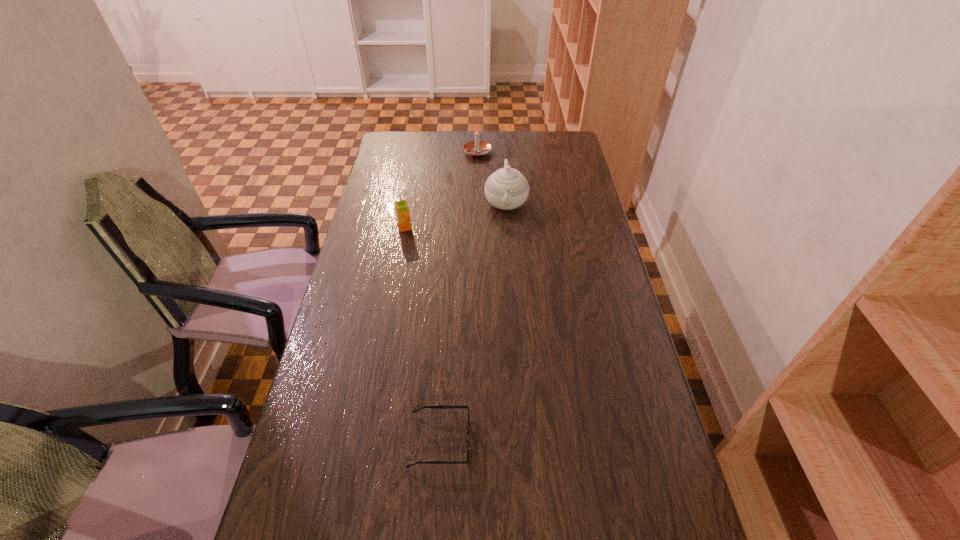
Identify the location of free space between the third farthest object and the second farthest object. (455, 215).

Where is `vacant area that lies between the candle and the nearest object`? The image size is (960, 540). vacant area that lies between the candle and the nearest object is located at coordinates (459, 296).

The image size is (960, 540). In order to click on empty space between the sunglasses and the candle in this screenshot , I will do `click(459, 296)`.

In order to click on object that stands as the second closest to the chinaware in this screenshot , I will do `click(401, 207)`.

Find the location of `object that is the second closest to the orange juice`. object that is the second closest to the orange juice is located at coordinates (477, 148).

I want to click on free region that satisfies the following two spatial constraints: 1. on the spout of the second farthest object; 2. at the front lenses of the sunglasses, so click(x=522, y=441).

The width and height of the screenshot is (960, 540). I want to click on vacant space that satisfies the following two spatial constraints: 1. on the spout of the second farthest object; 2. at the front lenses of the sunglasses, so click(522, 441).

I want to click on free space in the image that satisfies the following two spatial constraints: 1. on the front side of the candle; 2. at the front lenses of the nearest object, so click(x=475, y=441).

The width and height of the screenshot is (960, 540). What are the coordinates of `vacant space that satisfies the following two spatial constraints: 1. on the spout of the tallest object; 2. at the front lenses of the nearest object` in the screenshot? It's located at (522, 441).